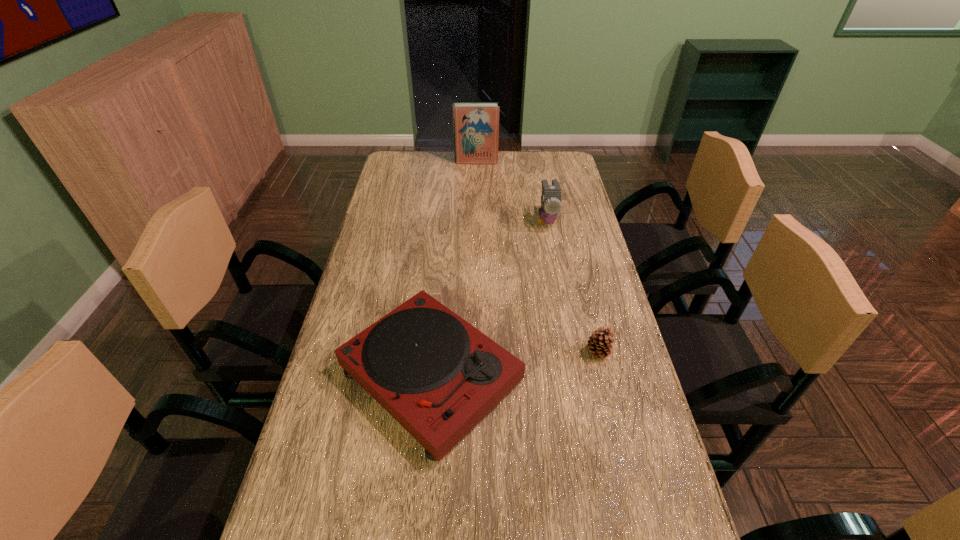
The image size is (960, 540). I want to click on hardback book, so click(x=476, y=125).

Identify the location of the farthest object. This screenshot has width=960, height=540. (476, 125).

Where is `the second object from right to left`? Image resolution: width=960 pixels, height=540 pixels. the second object from right to left is located at coordinates (551, 194).

Image resolution: width=960 pixels, height=540 pixels. Find the location of `the second farthest object`. the second farthest object is located at coordinates (551, 194).

Locate an element on the screen. record player is located at coordinates (438, 376).

This screenshot has width=960, height=540. I want to click on pinecone, so click(x=599, y=343).

This screenshot has width=960, height=540. I want to click on vacant space located on the cover of the farthest object, so click(x=476, y=207).

Identify the location of vacant space located at the beak of the third nearest object. 558,277.

What are the coordinates of `free region located on the back of the record player` in the screenshot? It's located at 444,229.

You are a GUI agent. You are given a task and a screenshot of the screen. Output one action in this format:
    pyautogui.click(x=<x>, y=<y>)
    Task: Click on the vacant region located on the back of the rightmost object
    This screenshot has height=540, width=960.
    Given the screenshot: What is the action you would take?
    pos(579,275)